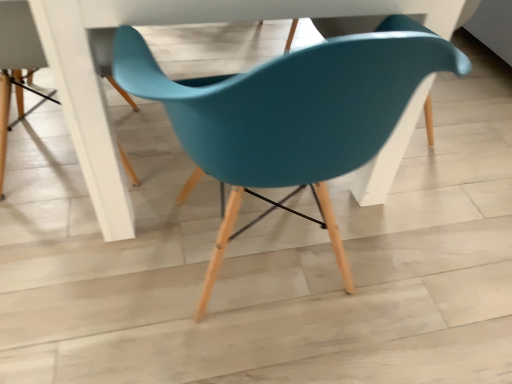
Locate an element on the screen. The height and width of the screenshot is (384, 512). vacant space to the right of teal plastic chair at center, the first chair in the right-to-left sequence is located at coordinates (436, 259).